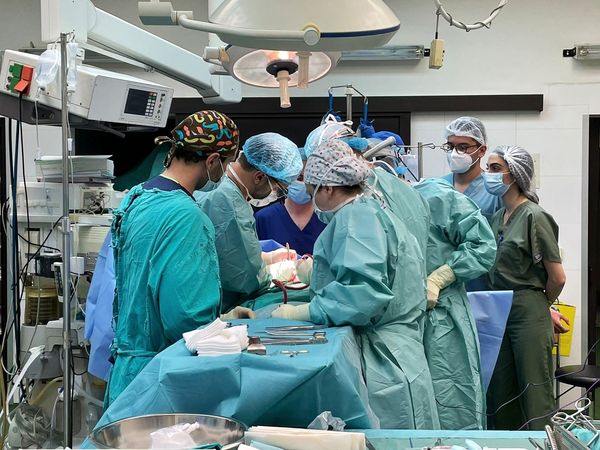
Locate an element on the screen. The height and width of the screenshot is (450, 600). overhead light is located at coordinates (265, 65), (292, 29).